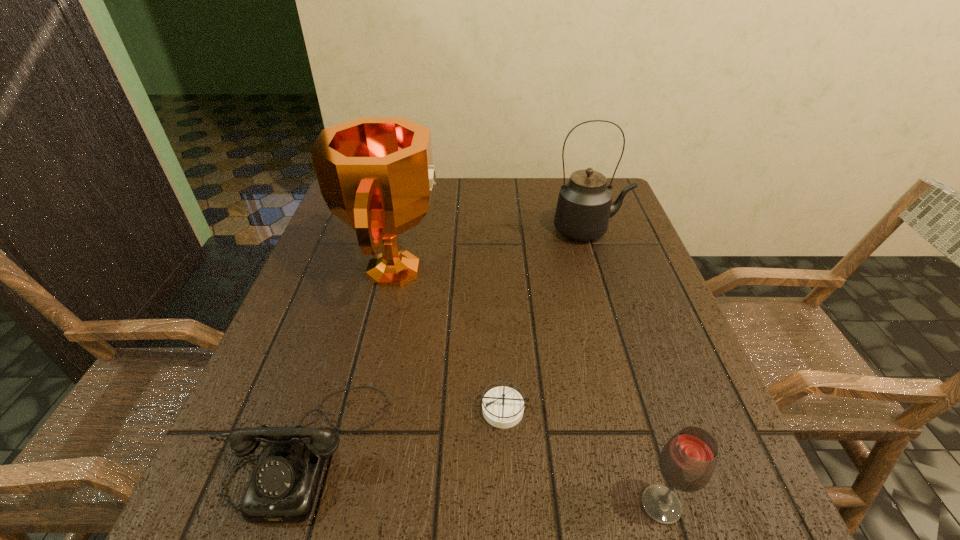
Identify the location of free spot that satisfies the following two spatial constraints: 1. spout on the kettle; 2. on the front side of the glass drink container. The image size is (960, 540). (679, 505).

The height and width of the screenshot is (540, 960). In order to click on vacant space that satisfies the following two spatial constraints: 1. on the back side of the glass drink container; 2. on the side of the award with the star emblem in this screenshot , I will do `click(591, 269)`.

Identify the location of vacant space that satisfies the following two spatial constraints: 1. on the front-facing side of the glass drink container; 2. on the right side of the fourth tallest object. (286, 505).